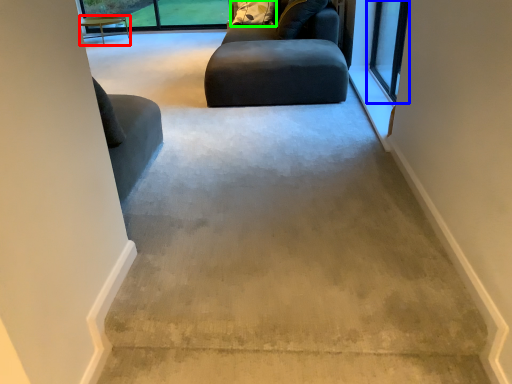
Question: Estimate the real-world distances between objects in this image. Which object is closer to table (highlighted by a red box), window (highlighted by a blue box) or pillow (highlighted by a green box)?

Choices:
 (A) window
 (B) pillow

Answer: (B)